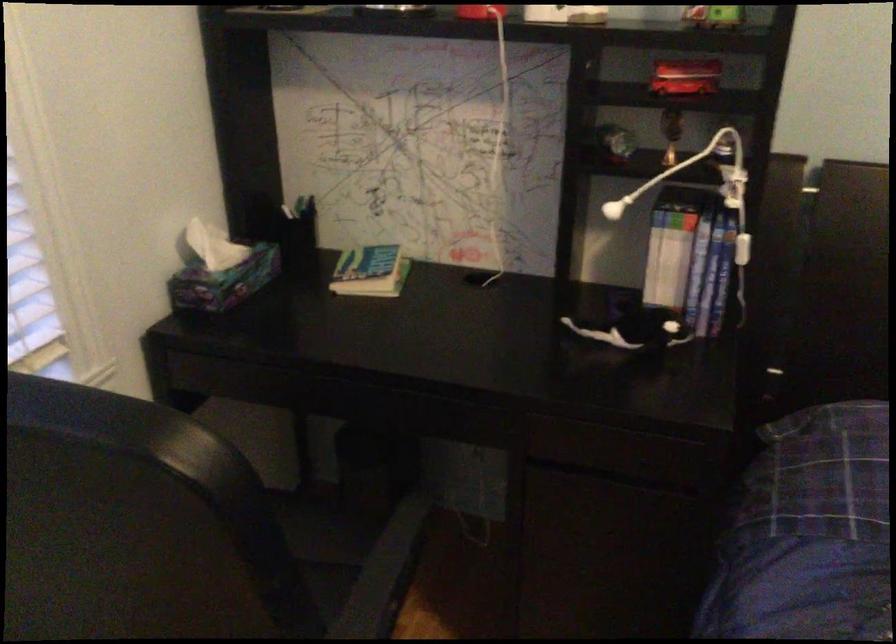
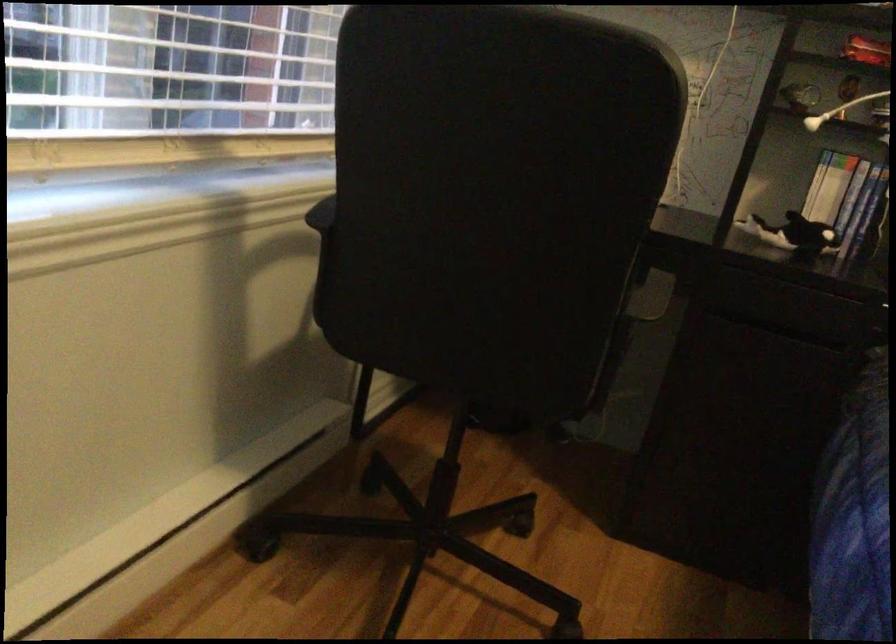
The point at (624,327) is marked in the first image. Where is the corresponding point in the second image?

(793, 234)